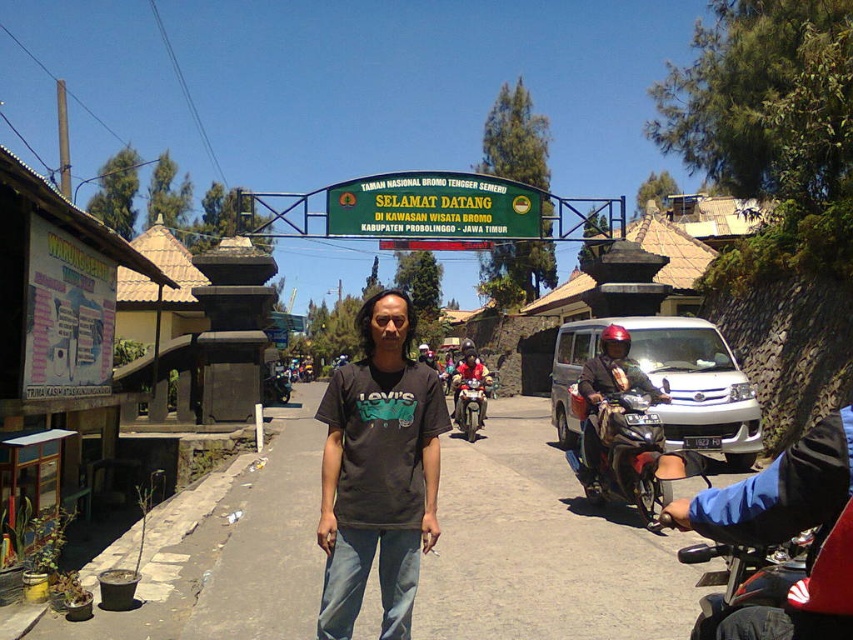
Looking at this image, you are a tourist who just arrived at the entrance of Taman Nasional Bromo Tengger Semeru. You see a metallic silver scooter at right and a matte black helmet at upper center. Which object is positioned higher from the ground?

The matte black helmet at upper center is positioned higher from the ground than the metallic silver scooter at right.

You are standing at the entrance of Taman Nasional Bromo Tengger Semeru and see two points marked on the ground. The first point is at coordinates point (x=398, y=477) and the second is at point (x=471, y=228). Which point is closer to you?

Point (x=398, y=477) is in front of point (x=471, y=228), so the first point is closer to you.